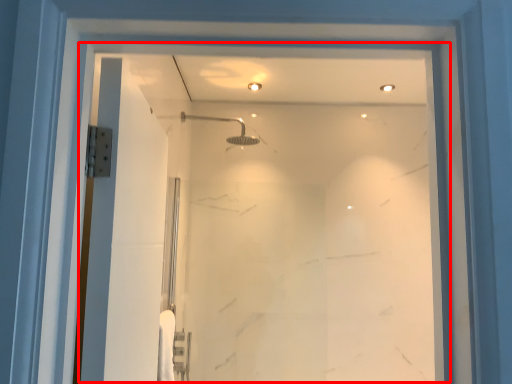
Question: From the image's perspective, what is the correct spatial positioning of glass door (annotated by the red box) in reference to shower?

Choices:
 (A) below
 (B) above

Answer: (A)